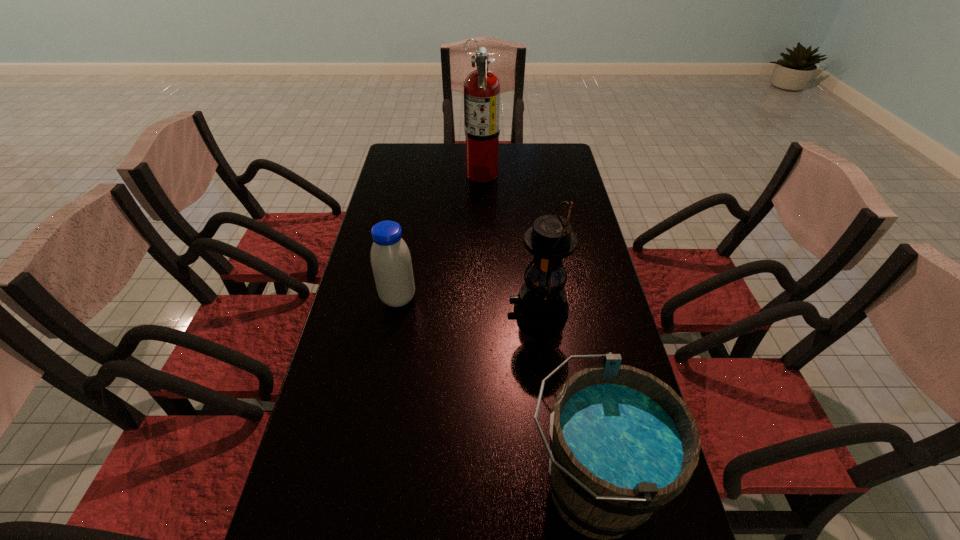
The width and height of the screenshot is (960, 540). In order to click on the farthest object in this screenshot , I will do `click(482, 87)`.

I want to click on the third object from right to left, so click(x=482, y=87).

I want to click on the third shortest object, so click(x=541, y=303).

The height and width of the screenshot is (540, 960). I want to click on soya milk, so click(x=391, y=263).

This screenshot has height=540, width=960. Identify the location of the shortest object. (391, 263).

This screenshot has width=960, height=540. I want to click on free location located 0.160m on the nozzle side of the tallest object, so click(425, 173).

Find the location of a particular element. free space located 0.090m on the nozzle side of the tallest object is located at coordinates (443, 173).

Where is `blank area located 0.240m on the nozzle side of the tallest object`? blank area located 0.240m on the nozzle side of the tallest object is located at coordinates (405, 173).

Identify a few spots in the free region located above the third shortest object, indicating its light source. Please provide its 2D coordinates. Your answer should be formatted as a tuple, i.e. [(x, y)], where the tuple contains the x and y coordinates of a point satisfying the conditions above.

[(423, 309)]

Locate some places in the vacant space located 0.330m above the third shortest object, indicating its light source. Please provide its 2D coordinates. Your answer should be formatted as a tuple, i.e. [(x, y)], where the tuple contains the x and y coordinates of a point satisfying the conditions above.

[(391, 309)]